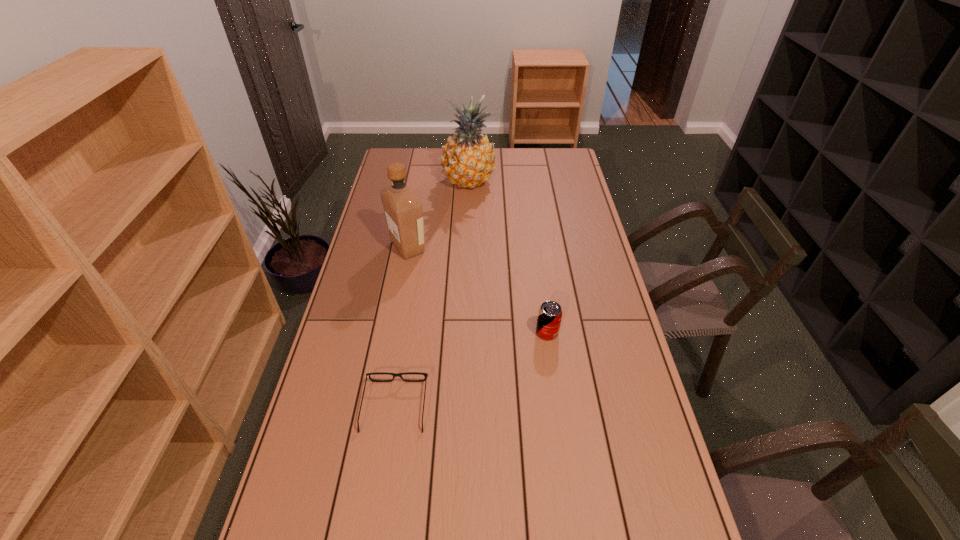
Identify the location of free space that satisfies the following two spatial constraints: 1. on the front-facing side of the second farthest object; 2. on the front-facing side of the nearest object. (379, 406).

Find the location of a particular element. vacant area in the image that satisfies the following two spatial constraints: 1. on the front-facing side of the nearest object; 2. on the left side of the farthest object is located at coordinates (429, 182).

You are a GUI agent. You are given a task and a screenshot of the screen. Output one action in this format:
    pyautogui.click(x=<x>, y=<y>)
    Task: Click on the vacant space that satisfies the following two spatial constraints: 1. on the front-facing side of the third nearest object; 2. on the right side of the second shortest object
    
    Given the screenshot: What is the action you would take?
    pyautogui.click(x=393, y=332)

This screenshot has height=540, width=960. In order to click on vacant space that satisfies the following two spatial constraints: 1. on the front-facing side of the liquor; 2. on the front-facing side of the spectacles in this screenshot , I will do `click(379, 406)`.

The width and height of the screenshot is (960, 540). Find the location of `free spot that satisfies the following two spatial constraints: 1. on the front-facing side of the farthest object; 2. on the right side of the shortest object`. free spot that satisfies the following two spatial constraints: 1. on the front-facing side of the farthest object; 2. on the right side of the shortest object is located at coordinates (429, 182).

Where is `vacant area that satisfies the following two spatial constraints: 1. on the front-facing side of the soda can; 2. on the left side of the spectacles`? vacant area that satisfies the following two spatial constraints: 1. on the front-facing side of the soda can; 2. on the left side of the spectacles is located at coordinates (406, 332).

Find the location of a particular element. The image size is (960, 540). vacant area that satisfies the following two spatial constraints: 1. on the front-facing side of the third tallest object; 2. on the left side of the third nearest object is located at coordinates (393, 332).